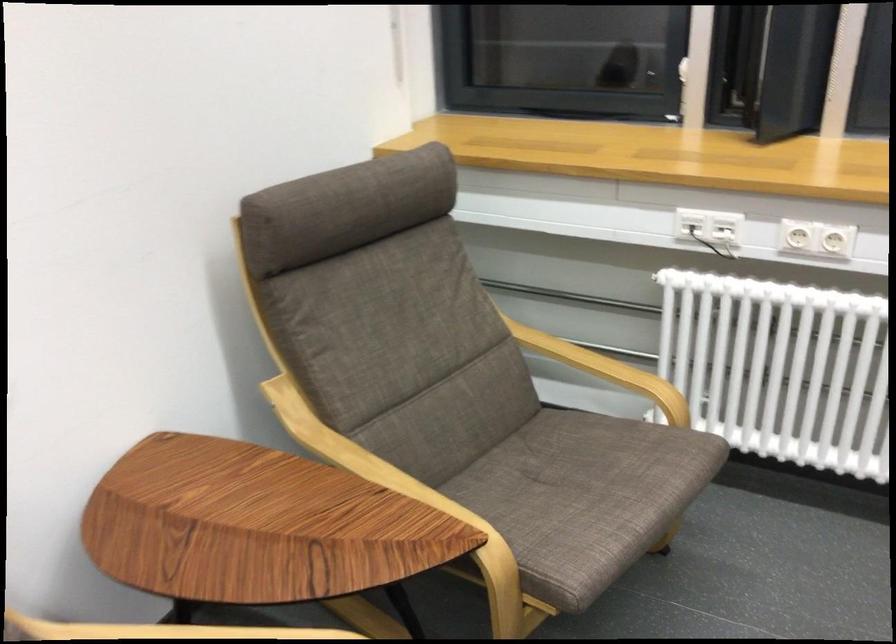
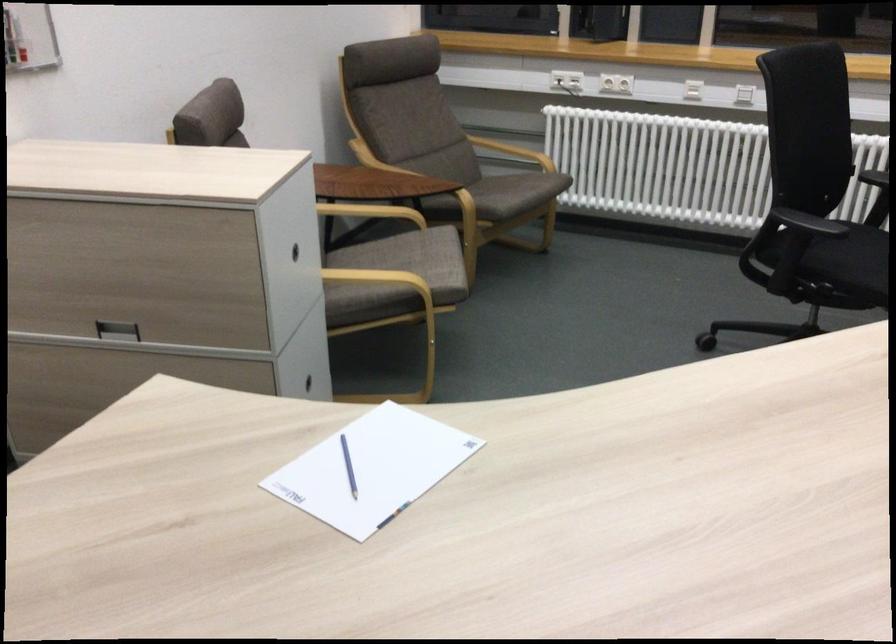
Find the pixel in the second image that matches (x=798, y=252) in the first image.

(616, 82)